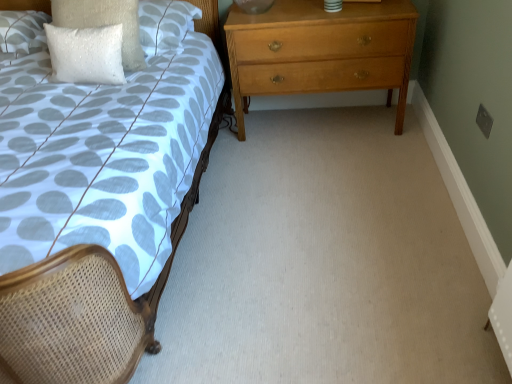
Locate an element on the screen. The image size is (512, 384). vacant location below light brown wooden chest of drawers at right (from a real-world perspective) is located at coordinates (321, 120).